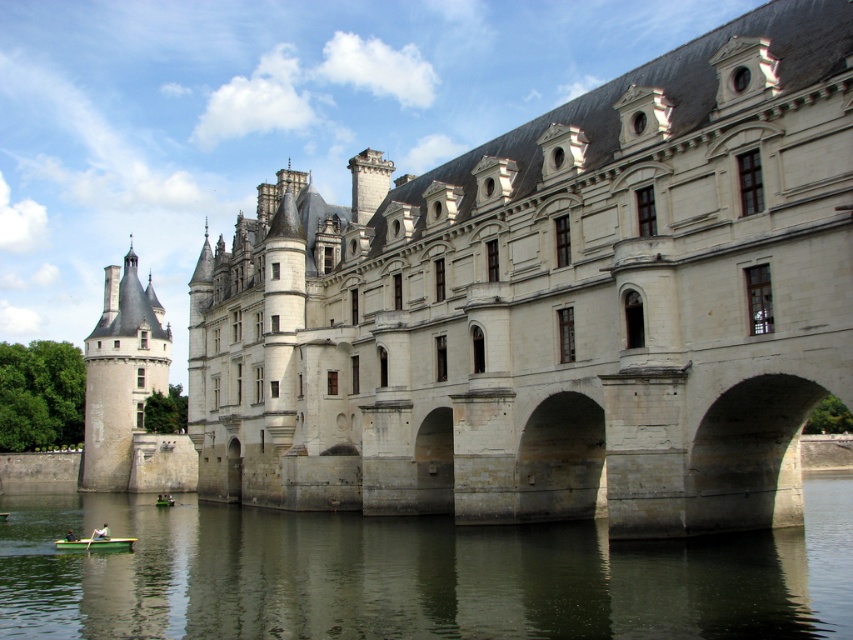
Question: Observing the image, what is the correct spatial positioning of green fabric boat at lower left in reference to green wood paddle at lower left?

Choices:
 (A) right
 (B) left

Answer: (B)

Question: Which of the following is the closest to the observer?

Choices:
 (A) (99, 538)
 (B) (103, 522)
 (C) (94, 531)
 (D) (514, 564)

Answer: (D)

Question: Is the position of green wooden boat at lower left more distant than that of green wood paddle at lower left?

Choices:
 (A) no
 (B) yes

Answer: (A)

Question: Does green water at lower left have a lesser width compared to green wooden boat at lower left?

Choices:
 (A) yes
 (B) no

Answer: (B)

Question: Considering the real-world distances, which object is closest to the green fabric boat at lower left?

Choices:
 (A) green water at lower left
 (B) green wooden boat at lower left
 (C) green wood paddle at lower left

Answer: (C)

Question: Which point appears farthest from the camera in this image?

Choices:
 (A) (x=103, y=529)
 (B) (x=82, y=540)

Answer: (B)